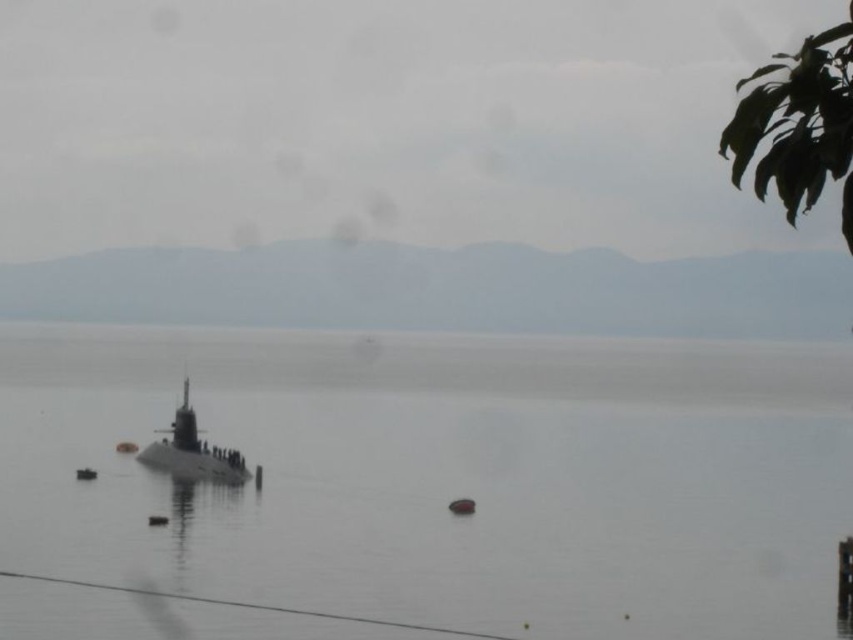
You are a marine biologist observing the submarine and water in the image. Which object is taller, the smooth gray water at center or the gray metallic submarine at center?

The smooth gray water at center is much taller than the gray metallic submarine at center.

Based on the photo, you are a marine biologist preparing to dive into the water near the submarine. You need to know how far the smooth gray water at center is from your current position. Can you determine the distance based on the scene?

The smooth gray water at center is 44.44 meters away from the camera, so the distance from your current position to the smooth gray water at center is approximately 44.44 meters.

Consider the image. You are a sailor trying to navigate a small boat through the calm waters near the gray metallic submarine at center. There are buoys around it. To avoid hitting the submarine, which direction should you steer your boat relative to the smooth gray water at center?

The smooth gray water at center is positioned on the right side of the gray metallic submarine at center. To avoid hitting the submarine, steer your boat to the left of the smooth gray water at center.